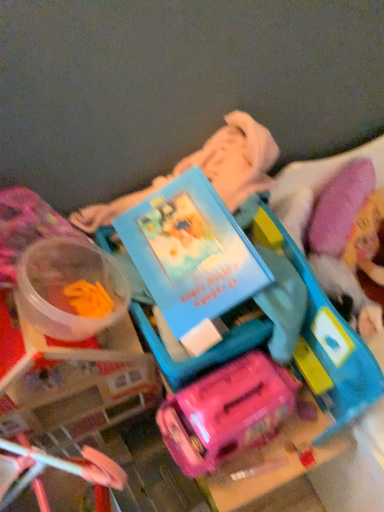
Where is `matte plastic suitcase at center, which is the second toy from left to right`? The width and height of the screenshot is (384, 512). matte plastic suitcase at center, which is the second toy from left to right is located at coordinates (320, 331).

From the image's perspective, is matte blue book at center beneath matte plastic suitcase at center, the first toy in the right-to-left sequence?

Incorrect, from the image's perspective, matte blue book at center is higher than matte plastic suitcase at center, the first toy in the right-to-left sequence.

Are matte blue book at center and matte plastic suitcase at center, the first toy in the right-to-left sequence, making contact?

No, matte blue book at center is not touching matte plastic suitcase at center, the first toy in the right-to-left sequence.

Does matte blue book at center have a greater width compared to matte plastic suitcase at center, which is the second toy from left to right?

Incorrect, the width of matte blue book at center does not surpass that of matte plastic suitcase at center, which is the second toy from left to right.

Is matte blue book at center positioned with its back to matte plastic suitcase at center, which is the second toy from left to right?

No, matte blue book at center's orientation is not away from matte plastic suitcase at center, which is the second toy from left to right.

Who is more distant, translucent plastic container at left, which is counted as the 2th toy, starting from the right, or matte plastic suitcase at center, the first toy in the right-to-left sequence?

translucent plastic container at left, which is counted as the 2th toy, starting from the right, is further from the camera.

Considering the relative sizes of translucent plastic container at left, which is counted as the 2th toy, starting from the right, and matte plastic suitcase at center, which is the second toy from left to right, in the image provided, is translucent plastic container at left, which is counted as the 2th toy, starting from the right, shorter than matte plastic suitcase at center, which is the second toy from left to right,?

Yes, translucent plastic container at left, which is counted as the 2th toy, starting from the right, is shorter than matte plastic suitcase at center, which is the second toy from left to right.

Could you tell me if translucent plastic container at left, arranged as the 1th toy when viewed from the left, is facing matte plastic suitcase at center, the first toy in the right-to-left sequence?

No, translucent plastic container at left, arranged as the 1th toy when viewed from the left, is not aimed at matte plastic suitcase at center, the first toy in the right-to-left sequence.

From a real-world perspective, does translucent plastic container at left, arranged as the 1th toy when viewed from the left, sit lower than matte plastic suitcase at center, the first toy in the right-to-left sequence?

No, from a real-world perspective, translucent plastic container at left, arranged as the 1th toy when viewed from the left, is not beneath matte plastic suitcase at center, the first toy in the right-to-left sequence.

Consider the image. Can you confirm if matte plastic suitcase at center, the first toy in the right-to-left sequence, is shorter than translucent plastic container at left, which is counted as the 2th toy, starting from the right?

Incorrect, the height of matte plastic suitcase at center, the first toy in the right-to-left sequence, does not fall short of that of translucent plastic container at left, which is counted as the 2th toy, starting from the right.

Can you tell me how much matte plastic suitcase at center, which is the second toy from left to right, and translucent plastic container at left, arranged as the 1th toy when viewed from the left, differ in facing direction?

The angle between the facing direction of matte plastic suitcase at center, which is the second toy from left to right, and the facing direction of translucent plastic container at left, arranged as the 1th toy when viewed from the left, is 2.29 degrees.

Does matte plastic suitcase at center, the first toy in the right-to-left sequence, have a larger size compared to translucent plastic container at left, which is counted as the 2th toy, starting from the right?

Yes, matte plastic suitcase at center, the first toy in the right-to-left sequence, is bigger than translucent plastic container at left, which is counted as the 2th toy, starting from the right.

Considering the positions of point (332, 388) and point (39, 331), is point (332, 388) closer or farther from the camera than point (39, 331)?

Point (332, 388) is positioned farther from the camera compared to point (39, 331).

Is matte plastic suitcase at center, which is the second toy from left to right, with matte blue book at center?

No, matte plastic suitcase at center, which is the second toy from left to right, is not touching matte blue book at center.

From the picture: How different are the orientations of matte plastic suitcase at center, the first toy in the right-to-left sequence, and matte blue book at center in degrees?

There is a 7.94-degree angle between the facing directions of matte plastic suitcase at center, the first toy in the right-to-left sequence, and matte blue book at center.

From a real-world perspective, is matte plastic suitcase at center, which is the second toy from left to right, below matte blue book at center?

Correct, in the physical world, matte plastic suitcase at center, which is the second toy from left to right, is lower than matte blue book at center.

Is matte plastic suitcase at center, the first toy in the right-to-left sequence, to the right of matte blue book at center from the viewer's perspective?

Yes.

Who is shorter, translucent plastic container at left, arranged as the 1th toy when viewed from the left, or matte blue book at center?

Standing shorter between the two is translucent plastic container at left, arranged as the 1th toy when viewed from the left.

Between point (31, 322) and point (145, 224), which one is positioned behind?

Point (145, 224)

From the image's perspective, is translucent plastic container at left, which is counted as the 2th toy, starting from the right, above matte blue book at center?

No.

From a real-world perspective, is translucent plastic container at left, arranged as the 1th toy when viewed from the left, physically located above or below matte blue book at center?

translucent plastic container at left, arranged as the 1th toy when viewed from the left, is situated lower than matte blue book at center in the real world.

Is matte blue book at center beside translucent plastic container at left, which is counted as the 2th toy, starting from the right?

No, matte blue book at center is not touching translucent plastic container at left, which is counted as the 2th toy, starting from the right.

Locate an element on the screen. The image size is (384, 512). book above the translucent plastic container at left, arranged as the 1th toy when viewed from the left (from a real-world perspective) is located at coordinates (191, 252).

How much distance is there between matte blue book at center and translucent plastic container at left, arranged as the 1th toy when viewed from the left?

matte blue book at center is 5.81 inches from translucent plastic container at left, arranged as the 1th toy when viewed from the left.

Which is further, (161,263) or (36,305)?

Positioned behind is point (161,263).

Locate an element on the screen. This screenshot has width=384, height=512. book behind the matte plastic suitcase at center, which is the second toy from left to right is located at coordinates (191, 252).

At what (x,y) coordinates should I click in order to perform the action: click on toy in front of the translucent plastic container at left, which is counted as the 2th toy, starting from the right. Please return your answer as a coordinate pair (x, y). The image size is (384, 512). Looking at the image, I should click on (320, 331).

From the picture: When comparing their distances from translucent plastic container at left, which is counted as the 2th toy, starting from the right, does matte plastic suitcase at center, the first toy in the right-to-left sequence, or matte blue book at center seem further?

Among the two, matte plastic suitcase at center, the first toy in the right-to-left sequence, is located further to translucent plastic container at left, which is counted as the 2th toy, starting from the right.

Consider the image. Looking at the image, which one is located further to translucent plastic container at left, which is counted as the 2th toy, starting from the right, matte blue book at center or matte plastic suitcase at center, which is the second toy from left to right?

Among the two, matte plastic suitcase at center, which is the second toy from left to right, is located further to translucent plastic container at left, which is counted as the 2th toy, starting from the right.

Considering their positions, is matte plastic suitcase at center, which is the second toy from left to right, positioned further to matte blue book at center than translucent plastic container at left, which is counted as the 2th toy, starting from the right?

The object further to matte blue book at center is matte plastic suitcase at center, which is the second toy from left to right.

Which object lies nearer to the anchor point matte blue book at center, translucent plastic container at left, arranged as the 1th toy when viewed from the left, or matte plastic suitcase at center, which is the second toy from left to right?

Among the two, translucent plastic container at left, arranged as the 1th toy when viewed from the left, is located nearer to matte blue book at center.

Considering their positions, is matte blue book at center positioned further to matte plastic suitcase at center, the first toy in the right-to-left sequence, than translucent plastic container at left, arranged as the 1th toy when viewed from the left?

translucent plastic container at left, arranged as the 1th toy when viewed from the left.

Which object lies nearer to the anchor point matte plastic suitcase at center, the first toy in the right-to-left sequence, translucent plastic container at left, which is counted as the 2th toy, starting from the right, or matte blue book at center?

matte blue book at center is closer to matte plastic suitcase at center, the first toy in the right-to-left sequence.

Find the location of a particular element. Image resolution: width=384 pixels, height=512 pixels. book located between translucent plastic container at left, arranged as the 1th toy when viewed from the left, and matte plastic suitcase at center, the first toy in the right-to-left sequence, in the left-right direction is located at coordinates (191, 252).